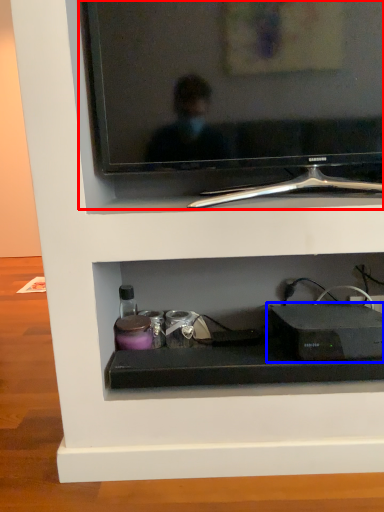
Question: Which of the following is the farthest to the observer, television (highlighted by a red box) or gadget (highlighted by a blue box)?

Choices:
 (A) television
 (B) gadget

Answer: (B)